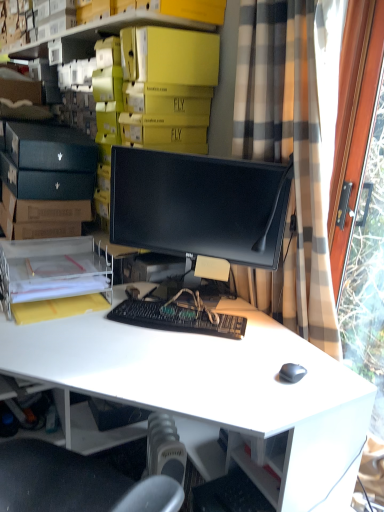
Where is `unoccupied area in front of black matte keyboard at center`? This screenshot has height=512, width=384. unoccupied area in front of black matte keyboard at center is located at coordinates (173, 366).